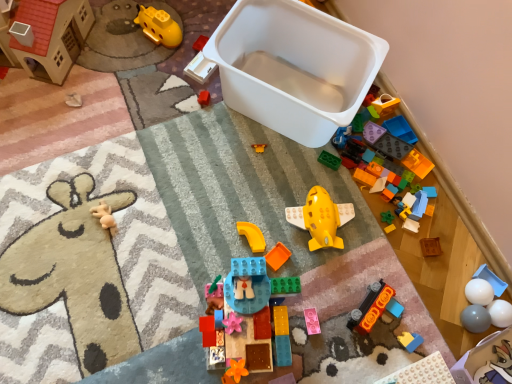
Identify the location of free space between beige rubber bear at left, placed as the 2th toy when sorted from left to right, and pink matte block at center, the tenth toy positioned from the right. The height and width of the screenshot is (384, 512). (186, 259).